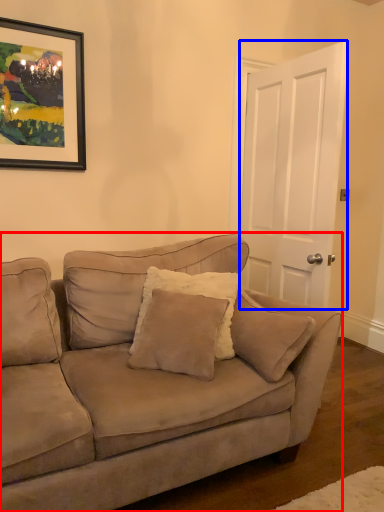
Question: Which point is further to the camera, studio couch (highlighted by a red box) or door (highlighted by a blue box)?

Choices:
 (A) studio couch
 (B) door

Answer: (B)